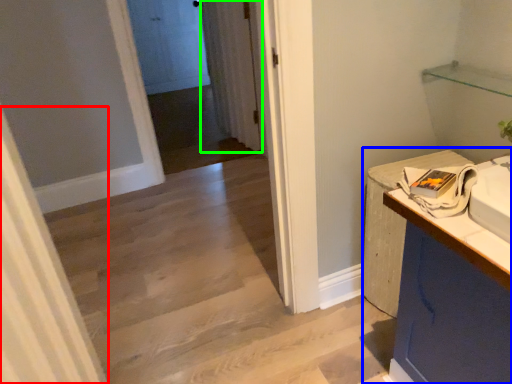
Question: Which object is positioned farthest from curtain (highlighted by a red box)? Select from counter (highlighted by a blue box) and curtain (highlighted by a green box).

Choices:
 (A) counter
 (B) curtain

Answer: (B)